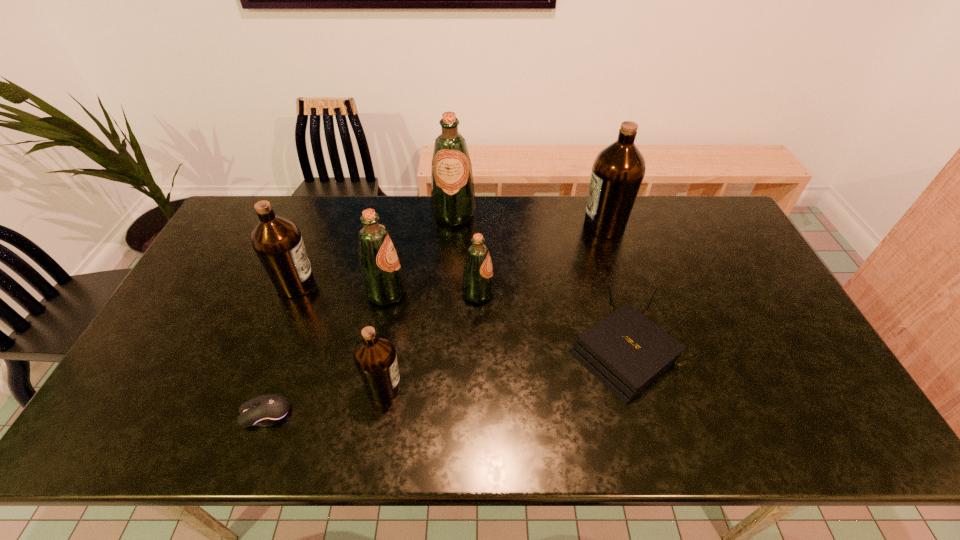
Find the location of `vacant region located on the label of the second brown olive oil from right to left`. vacant region located on the label of the second brown olive oil from right to left is located at coordinates (561, 387).

You are a GUI agent. You are given a task and a screenshot of the screen. Output one action in this format:
    pyautogui.click(x=<x>, y=<y>)
    Task: Click on the vacant area situated on the back of the router
    This screenshot has width=960, height=540.
    Given the screenshot: What is the action you would take?
    [x=597, y=251]

I want to click on vacant position located 0.310m on the right of the computer mouse, so click(x=421, y=413).

This screenshot has width=960, height=540. I want to click on object situated at the near edge, so click(268, 410).

Identify the location of vacant space at the far edge. tap(481, 222).

Where is `free location at the near edge`? This screenshot has height=540, width=960. free location at the near edge is located at coordinates (484, 424).

I want to click on free region at the left edge of the desktop, so click(x=183, y=379).

In the image, there is a desktop. At what (x,y) coordinates should I click in order to perform the action: click on free space at the right edge. Please return your answer as a coordinate pair (x, y). This screenshot has height=540, width=960. Looking at the image, I should click on (718, 257).

Identify the location of vacant space that is in between the second smallest green olive oil and the black computer mouse. The image size is (960, 540). (326, 353).

Locate an element on the screen. This screenshot has height=540, width=960. free space between the smallest brown olive oil and the router is located at coordinates (505, 370).